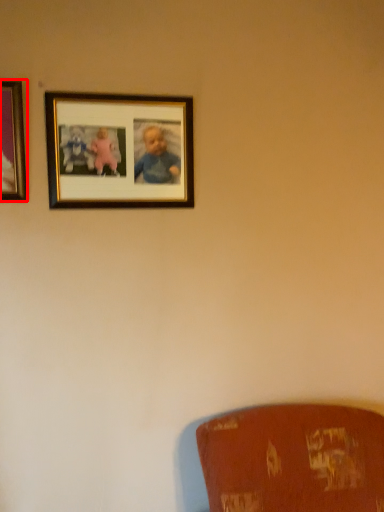
Question: Considering the relative positions of picture frame (annotated by the red box) and picture frame in the image provided, where is picture frame (annotated by the red box) located with respect to the staircase?

Choices:
 (A) left
 (B) right

Answer: (A)